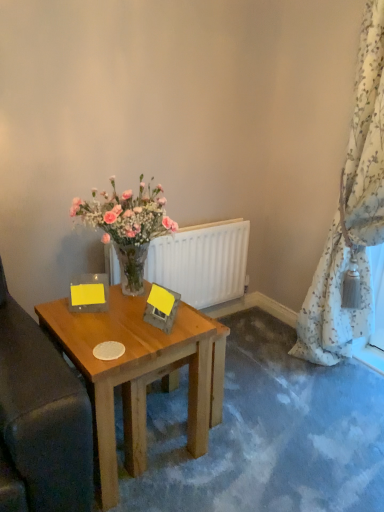
In order to click on vacant space situated above wooden table at center (from a real-world perspective) in this screenshot , I will do `click(115, 318)`.